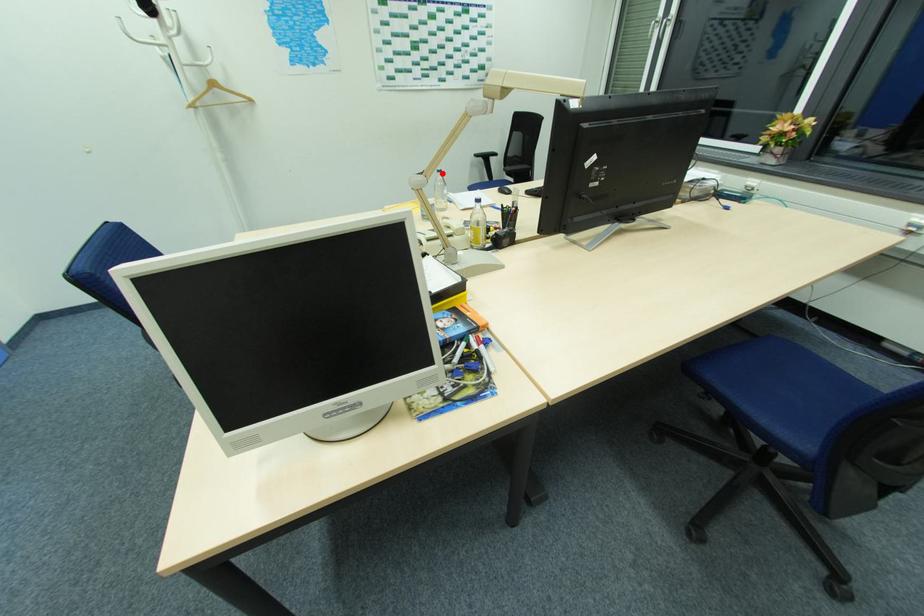
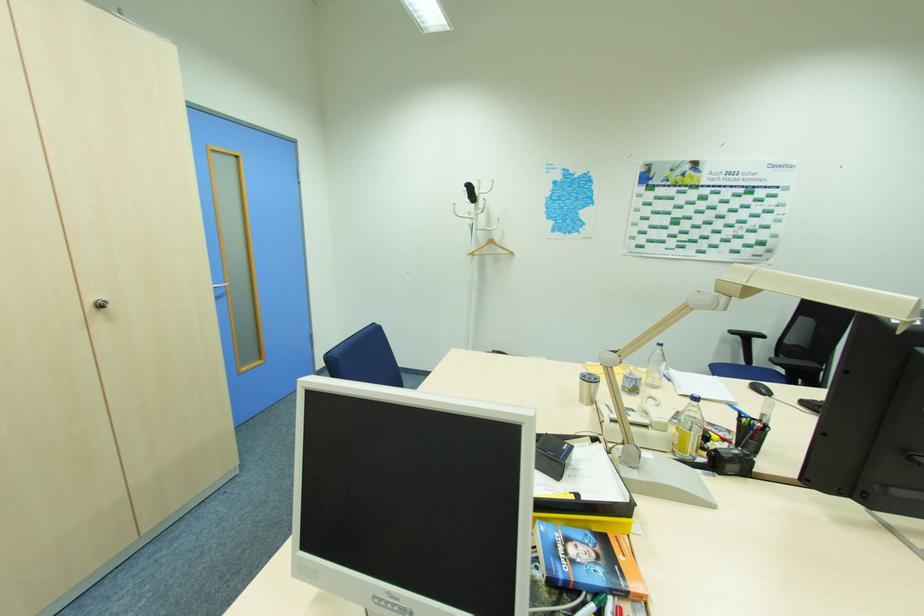
Find the pixel in the second image that matches the highlighted location in the first image.

(663, 347)